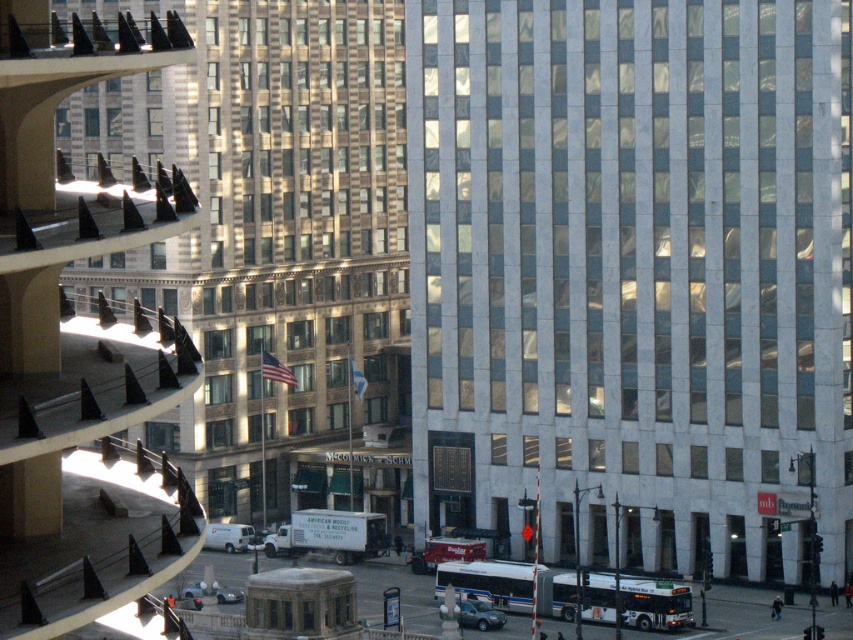
You are an architect analyzing the urban skyline. You observe the white marble building at center and the gold textured building at center. Which building would cast a longer shadow at this time of day?

The gold textured building at center is taller than the white marble building at center, so it would cast a longer shadow at this time of day.

You are an architect analyzing the urban layout. Given the white marble building at center and the gold textured building at center, which one has a smaller width from your viewpoint? Please base your answer on their spatial relationship as seen in the image.

The white marble building at center is thinner than the gold textured building at center, so the white marble building at center has a smaller width from the viewpoint.

Looking at this image, you are an architect analyzing the urban layout. From your vantage point, which building, the white marble building at center or the gold textured building at center, appears closer to you?

The white marble building at center appears closer because it is positioned over the gold textured building at center, indicating it is in a more foreground layer.